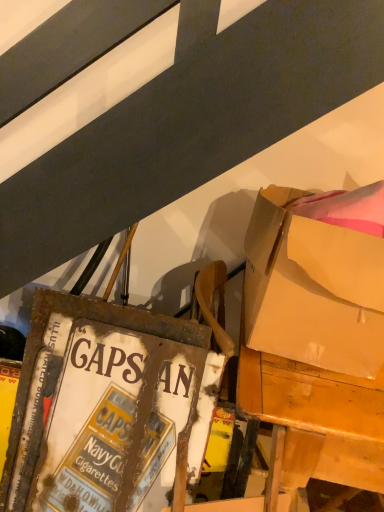
Question: Is wooden desk at right at the left side of rusty metal signboard at lower left?

Choices:
 (A) yes
 (B) no

Answer: (B)

Question: Would you consider wooden desk at right to be distant from rusty metal signboard at lower left?

Choices:
 (A) yes
 (B) no

Answer: (B)

Question: Is wooden desk at right next to rusty metal signboard at lower left?

Choices:
 (A) yes
 (B) no

Answer: (B)

Question: Considering the relative positions of wooden desk at right and rusty metal signboard at lower left in the image provided, is wooden desk at right behind rusty metal signboard at lower left?

Choices:
 (A) yes
 (B) no

Answer: (B)

Question: Is wooden desk at right completely or partially outside of rusty metal signboard at lower left?

Choices:
 (A) yes
 (B) no

Answer: (A)

Question: Can you confirm if wooden desk at right is smaller than rusty metal signboard at lower left?

Choices:
 (A) no
 (B) yes

Answer: (A)

Question: From a real-world perspective, is matte cardboard box at upper right beneath rusty metal signboard at lower left?

Choices:
 (A) no
 (B) yes

Answer: (A)

Question: Would you say matte cardboard box at upper right is outside rusty metal signboard at lower left?

Choices:
 (A) no
 (B) yes

Answer: (B)

Question: Is rusty metal signboard at lower left surrounded by matte cardboard box at upper right?

Choices:
 (A) yes
 (B) no

Answer: (B)

Question: Does matte cardboard box at upper right appear on the right side of rusty metal signboard at lower left?

Choices:
 (A) yes
 (B) no

Answer: (A)

Question: Is matte cardboard box at upper right at the left side of rusty metal signboard at lower left?

Choices:
 (A) no
 (B) yes

Answer: (A)

Question: From the image's perspective, is matte cardboard box at upper right above rusty metal signboard at lower left?

Choices:
 (A) yes
 (B) no

Answer: (A)

Question: Considering the relative positions of wooden desk at right and matte cardboard box at upper right in the image provided, is wooden desk at right behind matte cardboard box at upper right?

Choices:
 (A) no
 (B) yes

Answer: (B)